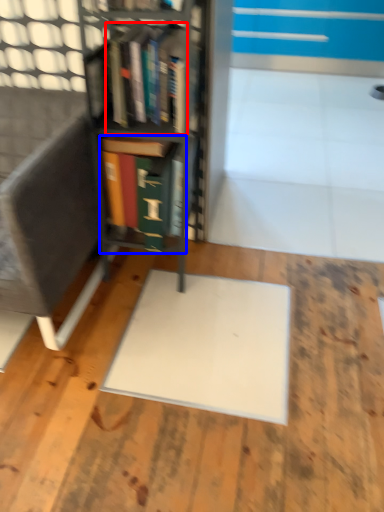
Question: Which object is further to the camera taking this photo, book (highlighted by a red box) or book (highlighted by a blue box)?

Choices:
 (A) book
 (B) book

Answer: (B)